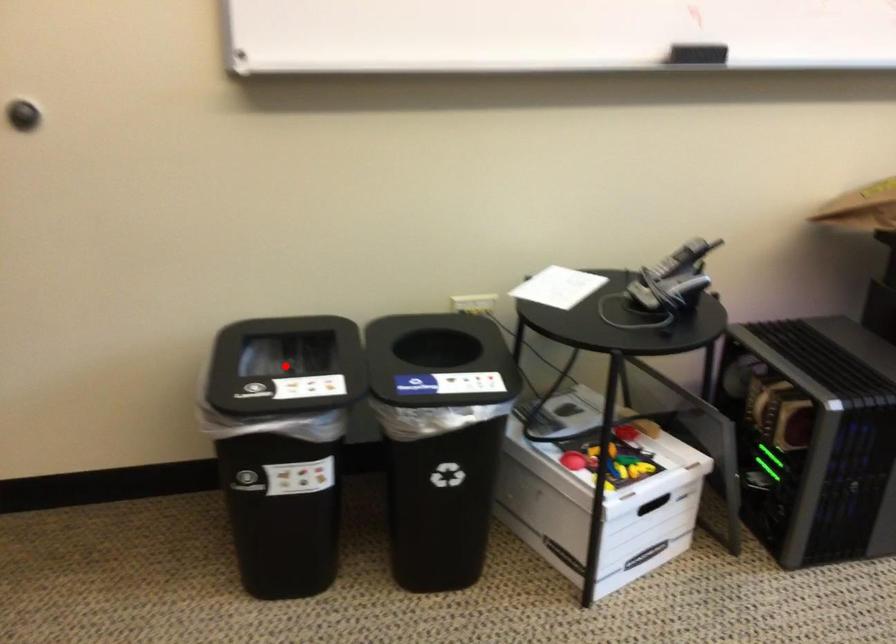
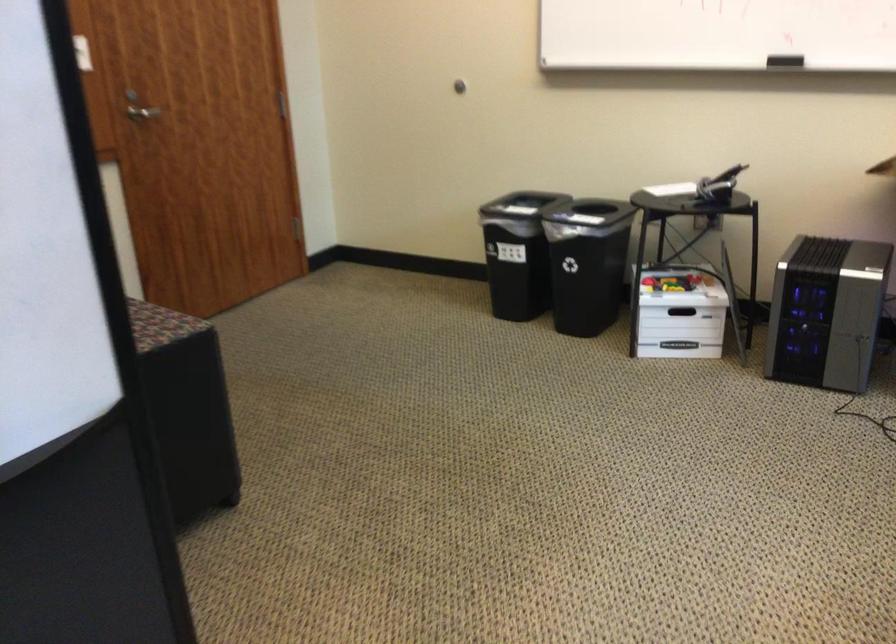
Question: I am providing you with two images of the same scene from different viewpoints. A red point is marked on the first image. At the location where the point appears in image 1, is it still visible in image 2?

Choices:
 (A) Yes
 (B) No

Answer: (B)